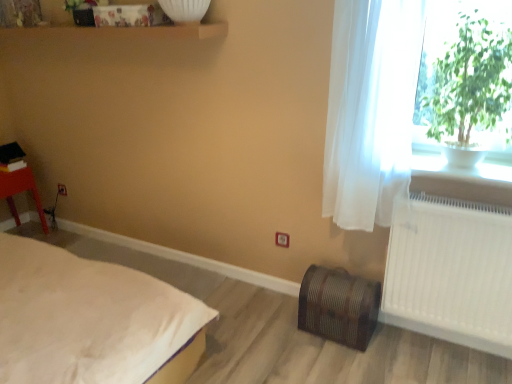
Question: Does matte plastic stool at left turn towards white ceramic pot at upper right?

Choices:
 (A) yes
 (B) no

Answer: (A)

Question: Can you confirm if matte plastic stool at left is wider than white ceramic pot at upper right?

Choices:
 (A) no
 (B) yes

Answer: (B)

Question: Is matte plastic stool at left at the right side of white ceramic pot at upper right?

Choices:
 (A) no
 (B) yes

Answer: (A)

Question: Can we say matte plastic stool at left lies outside white ceramic pot at upper right?

Choices:
 (A) yes
 (B) no

Answer: (A)

Question: Is the depth of matte plastic stool at left greater than that of white ceramic pot at upper right?

Choices:
 (A) no
 (B) yes

Answer: (B)

Question: From the image's perspective, does matte plastic stool at left appear higher than white ceramic pot at upper right?

Choices:
 (A) no
 (B) yes

Answer: (A)

Question: From the image's perspective, is matte plastic stool at left located above green leafy plant at upper right?

Choices:
 (A) no
 (B) yes

Answer: (A)

Question: Does matte plastic stool at left have a lesser width compared to green leafy plant at upper right?

Choices:
 (A) no
 (B) yes

Answer: (A)

Question: Considering the relative sizes of matte plastic stool at left and green leafy plant at upper right in the image provided, is matte plastic stool at left bigger than green leafy plant at upper right?

Choices:
 (A) yes
 (B) no

Answer: (B)

Question: From a real-world perspective, is matte plastic stool at left physically below green leafy plant at upper right?

Choices:
 (A) no
 (B) yes

Answer: (B)

Question: From the image's perspective, would you say matte plastic stool at left is shown under green leafy plant at upper right?

Choices:
 (A) no
 (B) yes

Answer: (B)

Question: From a real-world perspective, is matte plastic stool at left physically above green leafy plant at upper right?

Choices:
 (A) no
 (B) yes

Answer: (A)

Question: From a real-world perspective, is matte plastic stool at left beneath white plastic radiator at right?

Choices:
 (A) no
 (B) yes

Answer: (B)